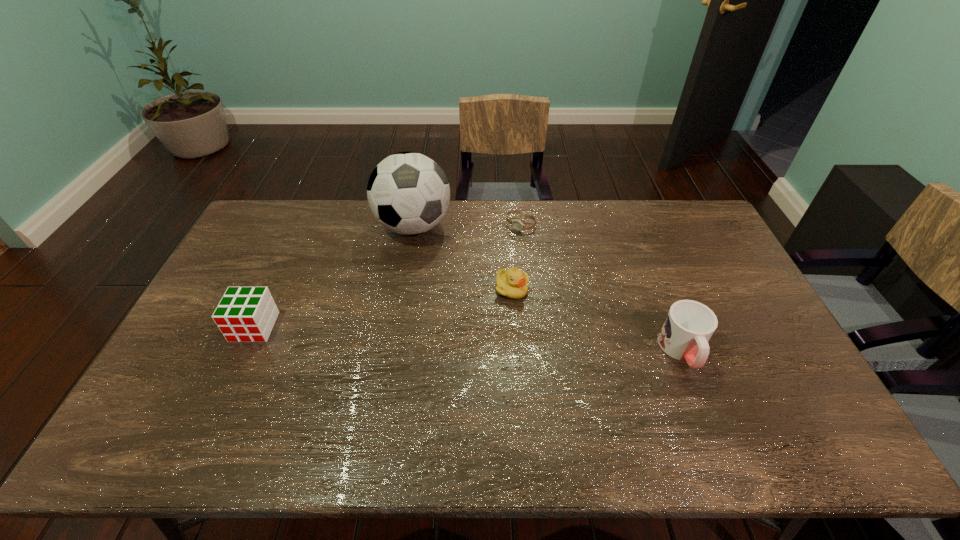
This screenshot has width=960, height=540. I want to click on free space located 0.130m on the face of the shortest object, so click(x=493, y=251).

Identify the location of free region located 0.280m on the face of the shortest object. The width and height of the screenshot is (960, 540). (468, 277).

You are a GUI agent. You are given a task and a screenshot of the screen. Output one action in this format:
    pyautogui.click(x=<x>, y=<y>)
    Task: Click on the vacant space located on the beak of the second shortest object
    This screenshot has width=960, height=540.
    Given the screenshot: What is the action you would take?
    pyautogui.click(x=520, y=318)

Find the location of a particular element. blank space located 0.370m on the beak of the second shortest object is located at coordinates (545, 410).

At what (x,y) coordinates should I click in order to perform the action: click on free space located 0.340m on the beak of the second shortest object. Please return your answer as a coordinate pair (x, y). The height and width of the screenshot is (540, 960). Looking at the image, I should click on (542, 400).

Where is `vacant space located on the main logo of the second object from left to right`? The image size is (960, 540). vacant space located on the main logo of the second object from left to right is located at coordinates (420, 319).

Find the location of `free location located on the main logo of the second object from left to right`. free location located on the main logo of the second object from left to right is located at coordinates (420, 306).

In order to click on free location located on the main logo of the second object from left to right in this screenshot , I will do `click(417, 269)`.

Locate an element on the screen. watch present at the far edge is located at coordinates (517, 224).

At what (x,y) coordinates should I click in order to perform the action: click on soccer ball located in the far edge section of the desktop. Please return your answer as a coordinate pair (x, y). The height and width of the screenshot is (540, 960). Looking at the image, I should click on (408, 193).